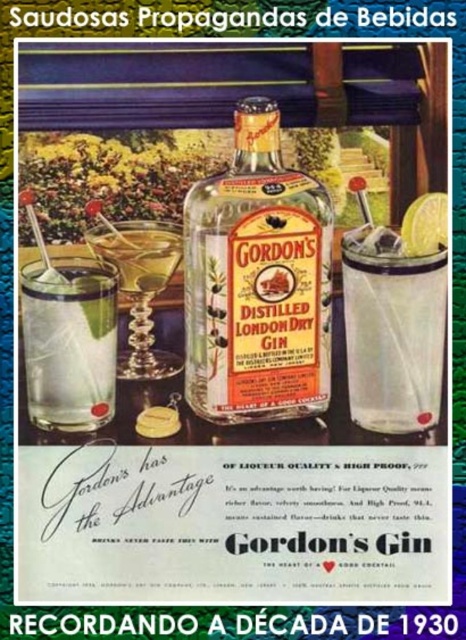
Question: Where is shiny silver martini glass at center-left located in relation to yellow matte lime at upper right in the image?

Choices:
 (A) right
 (B) left

Answer: (B)

Question: Which point is farther to the camera?

Choices:
 (A) clear glass at lower left
 (B) translucent glass bottle at center
 (C) clear glass with ice at center
 (D) shiny silver martini glass at center-left

Answer: (D)

Question: Based on their relative distances, which object is farther from the translucent glass bottle at center?

Choices:
 (A) yellow matte lime at upper right
 (B) shiny silver martini glass at center-left

Answer: (A)

Question: Which object appears farthest from the camera in this image?

Choices:
 (A) shiny silver martini glass at center-left
 (B) clear glass with ice at center

Answer: (A)

Question: Is clear glass at lower left in front of shiny silver martini glass at center-left?

Choices:
 (A) yes
 (B) no

Answer: (A)

Question: In this image, where is clear glass with ice at center located relative to yellow matte lime at upper right?

Choices:
 (A) left
 (B) right

Answer: (A)